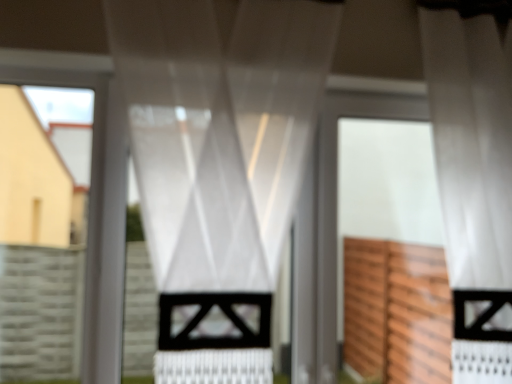
Question: Is white sheer curtain at center, the 2th curtain from the left, further to the viewer compared to white matte screen door at center?

Choices:
 (A) no
 (B) yes

Answer: (A)

Question: Considering the relative sizes of white sheer curtain at center, acting as the 1th curtain starting from the right, and white matte screen door at center in the image provided, is white sheer curtain at center, acting as the 1th curtain starting from the right, shorter than white matte screen door at center?

Choices:
 (A) no
 (B) yes

Answer: (A)

Question: Is white sheer curtain at center, the 2th curtain from the left, smaller than white matte screen door at center?

Choices:
 (A) no
 (B) yes

Answer: (A)

Question: Is white sheer curtain at center, the 2th curtain from the left, far from white matte screen door at center?

Choices:
 (A) yes
 (B) no

Answer: (B)

Question: Can you confirm if white sheer curtain at center, the 2th curtain from the left, is positioned to the left of white matte screen door at center?

Choices:
 (A) yes
 (B) no

Answer: (B)

Question: Is white matte screen door at center in front of or behind satin white curtain at center, which is the 1th curtain in left-to-right order, in the image?

Choices:
 (A) behind
 (B) front

Answer: (A)

Question: From the image's perspective, is white matte screen door at center above or below satin white curtain at center, which is the 1th curtain in left-to-right order?

Choices:
 (A) above
 (B) below

Answer: (B)

Question: Visually, is white matte screen door at center positioned to the left or to the right of satin white curtain at center, which is counted as the second curtain, starting from the right?

Choices:
 (A) right
 (B) left

Answer: (A)

Question: Considering the positions of white matte screen door at center and satin white curtain at center, which is the 1th curtain in left-to-right order, in the image, is white matte screen door at center bigger or smaller than satin white curtain at center, which is the 1th curtain in left-to-right order,?

Choices:
 (A) small
 (B) big

Answer: (A)

Question: From the image's perspective, is white matte screen door at center above or below white sheer curtain at center, the 2th curtain from the left?

Choices:
 (A) above
 (B) below

Answer: (B)

Question: In terms of width, does white matte screen door at center look wider or thinner when compared to white sheer curtain at center, the 2th curtain from the left?

Choices:
 (A) thin
 (B) wide

Answer: (A)

Question: Is white matte screen door at center to the left or to the right of white sheer curtain at center, the 2th curtain from the left, in the image?

Choices:
 (A) left
 (B) right

Answer: (A)

Question: From a real-world perspective, is white matte screen door at center positioned above or below white sheer curtain at center, acting as the 1th curtain starting from the right?

Choices:
 (A) below
 (B) above

Answer: (A)

Question: Is white sheer curtain at center, acting as the 1th curtain starting from the right, in front of or behind white matte screen door at center in the image?

Choices:
 (A) behind
 (B) front

Answer: (B)

Question: Is white sheer curtain at center, the 2th curtain from the left, taller or shorter than white matte screen door at center?

Choices:
 (A) tall
 (B) short

Answer: (A)